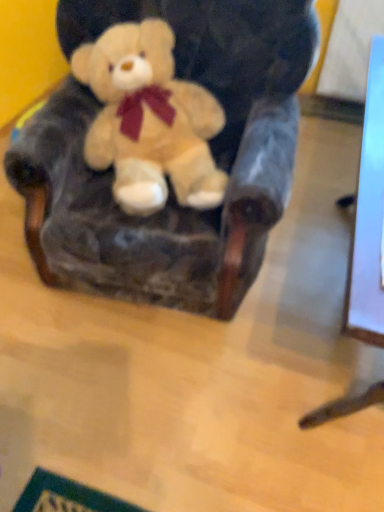
Question: Is velvet plush bear at center bigger or smaller than soft plush teddy bear at center?

Choices:
 (A) big
 (B) small

Answer: (A)

Question: In terms of width, does velvet plush bear at center look wider or thinner when compared to soft plush teddy bear at center?

Choices:
 (A) thin
 (B) wide

Answer: (B)

Question: Do you think velvet plush bear at center is within soft plush teddy bear at center, or outside of it?

Choices:
 (A) inside
 (B) outside

Answer: (B)

Question: From the image's perspective, is soft plush teddy bear at center above or below velvet plush bear at center?

Choices:
 (A) below
 (B) above

Answer: (B)

Question: Visually, is soft plush teddy bear at center positioned to the left or to the right of velvet plush bear at center?

Choices:
 (A) left
 (B) right

Answer: (A)

Question: In terms of height, does soft plush teddy bear at center look taller or shorter compared to velvet plush bear at center?

Choices:
 (A) tall
 (B) short

Answer: (B)

Question: Is soft plush teddy bear at center bigger or smaller than velvet plush bear at center?

Choices:
 (A) small
 (B) big

Answer: (A)